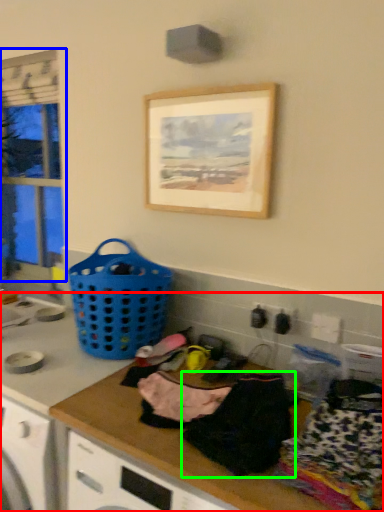
Question: Estimate the real-world distances between objects in this image. Which object is farther from counter top (highlighted by a red box), window (highlighted by a blue box) or clothing (highlighted by a green box)?

Choices:
 (A) window
 (B) clothing

Answer: (A)